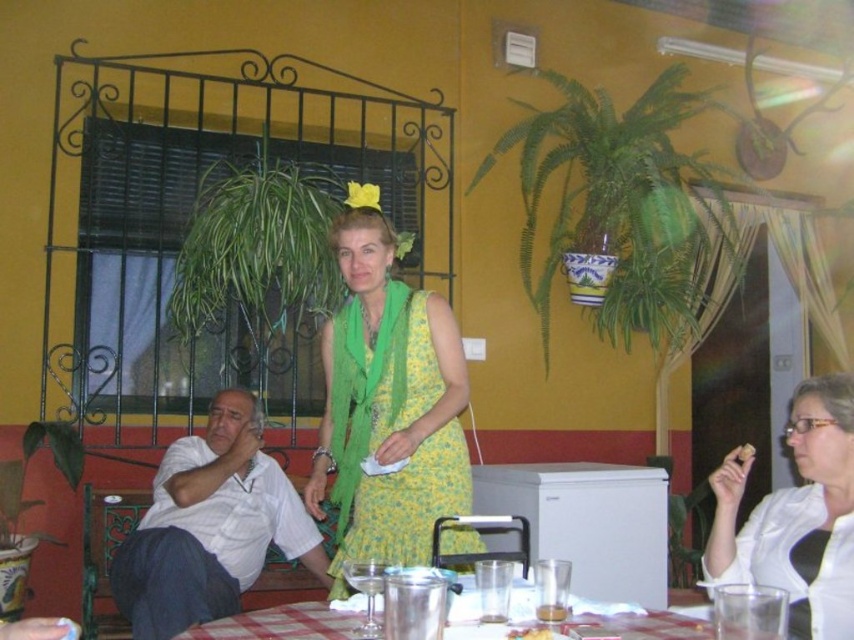
You are a tailor trying to determine which shirt to recommend for a customer with a narrow frame. Based on the image, which shirt between the white cotton shirt at center and the white glossy shirt at lower right would you suggest?

The white glossy shirt at lower right should be recommended since it might be narrower than the white cotton shirt at center.

You are a customer in the restaurant and want to choose a shirt to wear. Which one is bigger between the white cotton shirt at center and the white glossy shirt at lower right?

The white cotton shirt at center is larger in size than the white glossy shirt at lower right.

You are a customer sitting at the checkered fabric table at lower center and want to reach the white crumb at upper right. Can you easily grab it without moving your seat?

The checkered fabric table at lower center is closer to the viewer than the white crumb at upper right, so the crumb is farther away. You would need to stretch or move your seat to reach it.